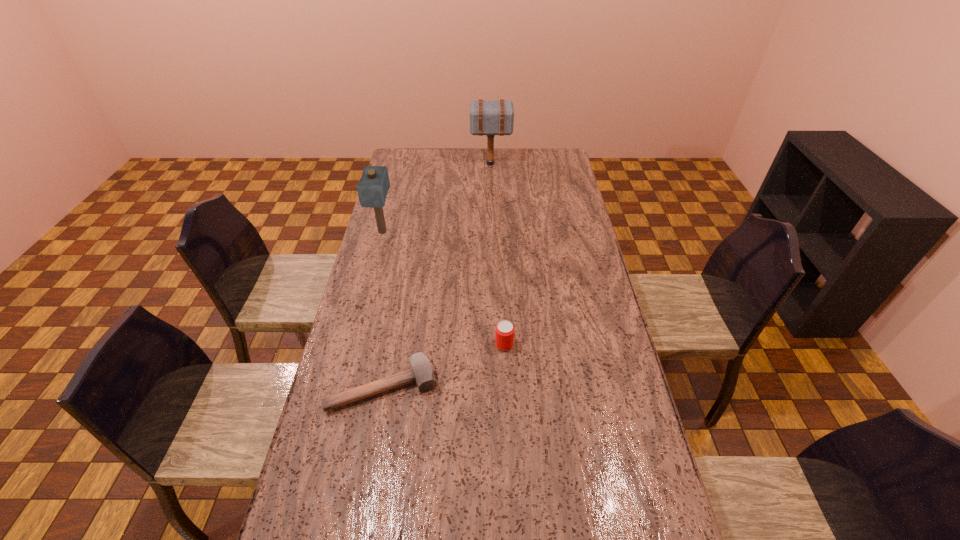
Select which mallet is the third closest to the second nearest object. Please provide its 2D coordinates. Your answer should be formatted as a tuple, i.e. [(x, y)], where the tuple contains the x and y coordinates of a point satisfying the conditions above.

[(487, 117)]

Where is `free location that satisfies the following two spatial constraints: 1. on the front side of the second shortest object; 2. on the right side of the third nearest object`? This screenshot has height=540, width=960. free location that satisfies the following two spatial constraints: 1. on the front side of the second shortest object; 2. on the right side of the third nearest object is located at coordinates (354, 345).